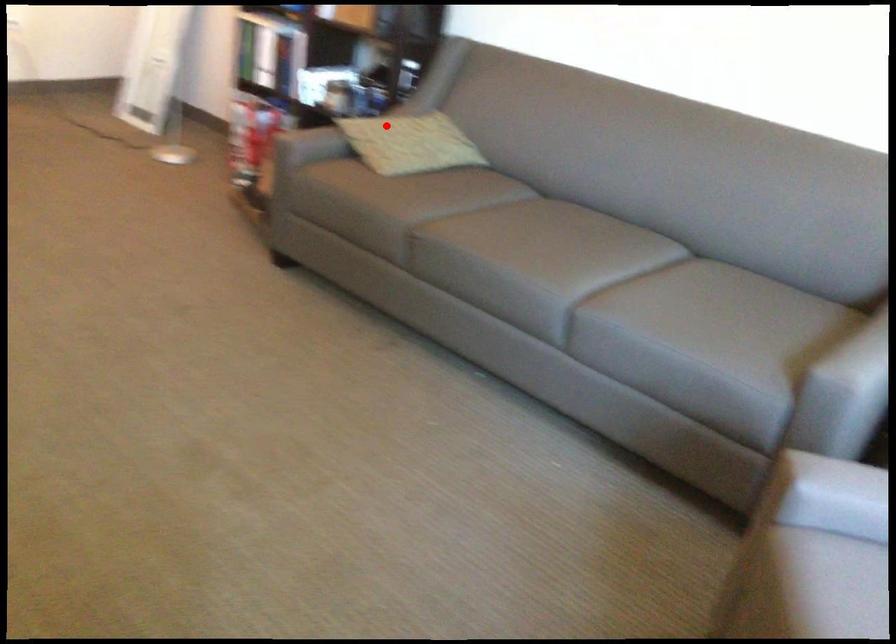
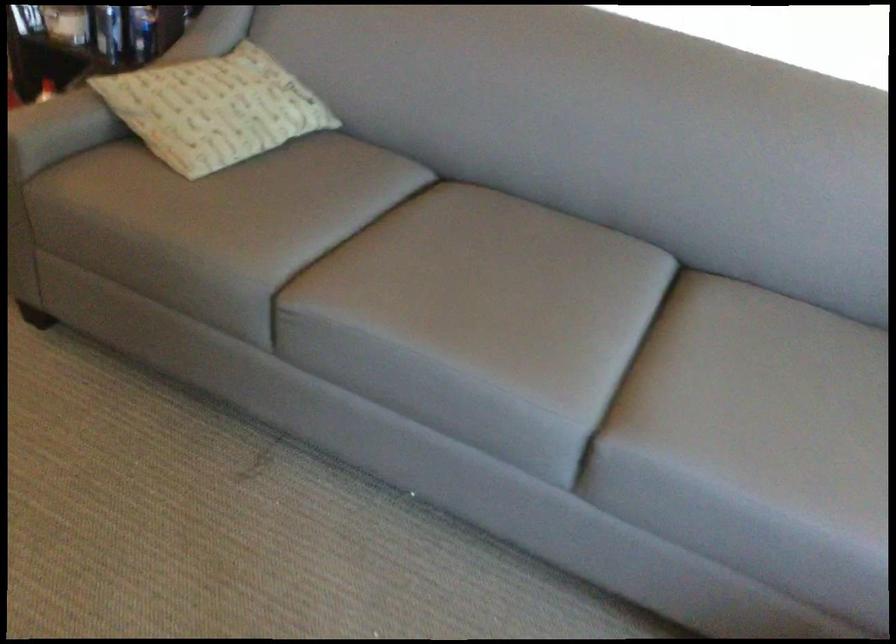
Question: I am providing you with two images of the same scene from different viewpoints. Image1 has a red point marked. In image2, the corresponding 3D location appears at what relative position? Reply with the corresponding letter.

Choices:
 (A) Closer
 (B) Farther

Answer: (A)